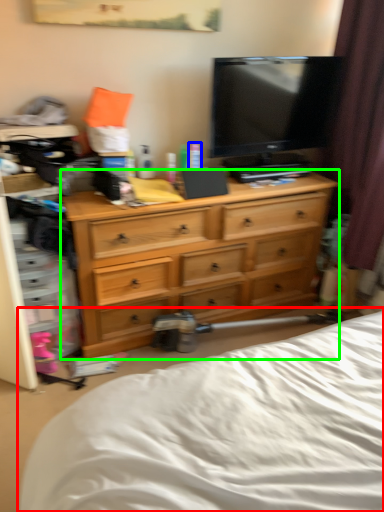
Question: Which object is the closest to the bed (highlighted by a red box)? Choose among these: toiletry (highlighted by a blue box) or chest of drawers (highlighted by a green box).

Choices:
 (A) toiletry
 (B) chest of drawers

Answer: (B)